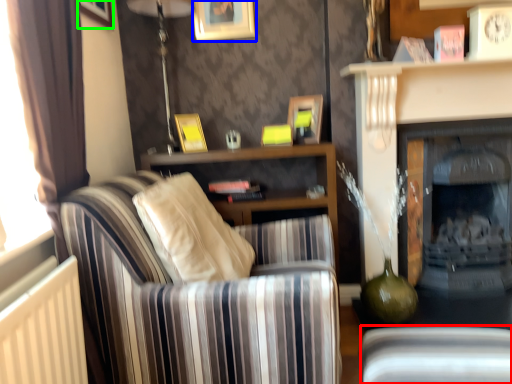
Question: Based on their relative distances, which object is farther from swivel chair (highlighted by a red box)? Choose from picture frame (highlighted by a blue box) and picture frame (highlighted by a green box).

Choices:
 (A) picture frame
 (B) picture frame

Answer: (B)